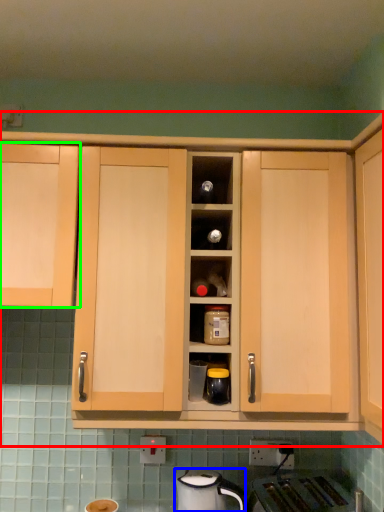
Question: Estimate the real-world distances between objects in this image. Which object is closer to cabinetry (highlighted by a red box), home appliance (highlighted by a blue box) or cabinetry (highlighted by a green box)?

Choices:
 (A) home appliance
 (B) cabinetry

Answer: (B)